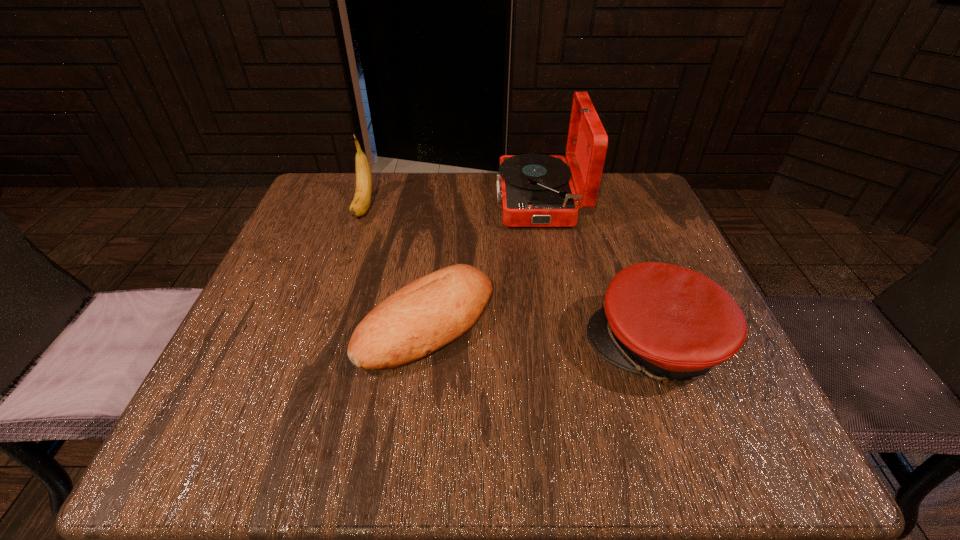
Where is `phonograph_record`? The width and height of the screenshot is (960, 540). phonograph_record is located at coordinates (536, 190).

Locate an element on the screen. Image resolution: width=960 pixels, height=540 pixels. the leftmost object is located at coordinates (360, 204).

Find the location of `the third shortest object`. the third shortest object is located at coordinates (360, 204).

You are a GUI agent. You are given a task and a screenshot of the screen. Output one action in this format:
    pyautogui.click(x=<x>, y=<y>)
    Task: Click on the cap
    The height and width of the screenshot is (540, 960).
    Given the screenshot: What is the action you would take?
    pyautogui.click(x=670, y=323)

Find the location of a particular element. The image size is (960, 540). bread is located at coordinates (431, 312).

Where is `the shortest object`? the shortest object is located at coordinates (431, 312).

Locate an element on the screen. vacant space located on the front-facing side of the tallest object is located at coordinates (439, 199).

At what (x,y) coordinates should I click in order to perform the action: click on vacant space located 0.160m on the front-facing side of the tallest object. Please return your answer as a coordinate pair (x, y). The width and height of the screenshot is (960, 540). Looking at the image, I should click on (430, 199).

Locate an element on the screen. free space located on the front-facing side of the tallest object is located at coordinates (331, 199).

Image resolution: width=960 pixels, height=540 pixels. What are the coordinates of `vacant space located at the start of the peel on the banana` in the screenshot? It's located at (324, 322).